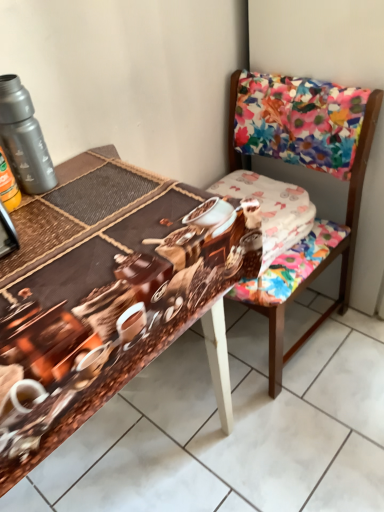
Find the location of `free spot above brown printed fabric at center (from a real-world perspective)`. free spot above brown printed fabric at center (from a real-world perspective) is located at coordinates (87, 222).